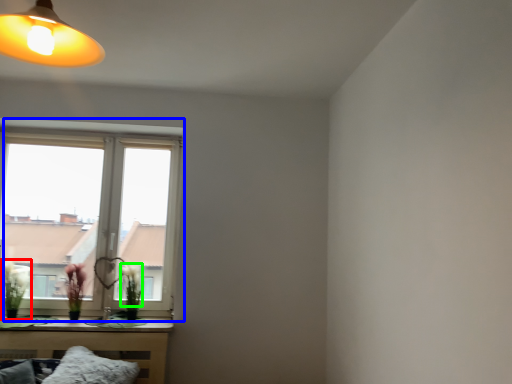
Question: Which object is the closest to the floral arrangement (highlighted by a red box)? Choose among these: window (highlighted by a blue box) or flower (highlighted by a green box).

Choices:
 (A) window
 (B) flower

Answer: (A)